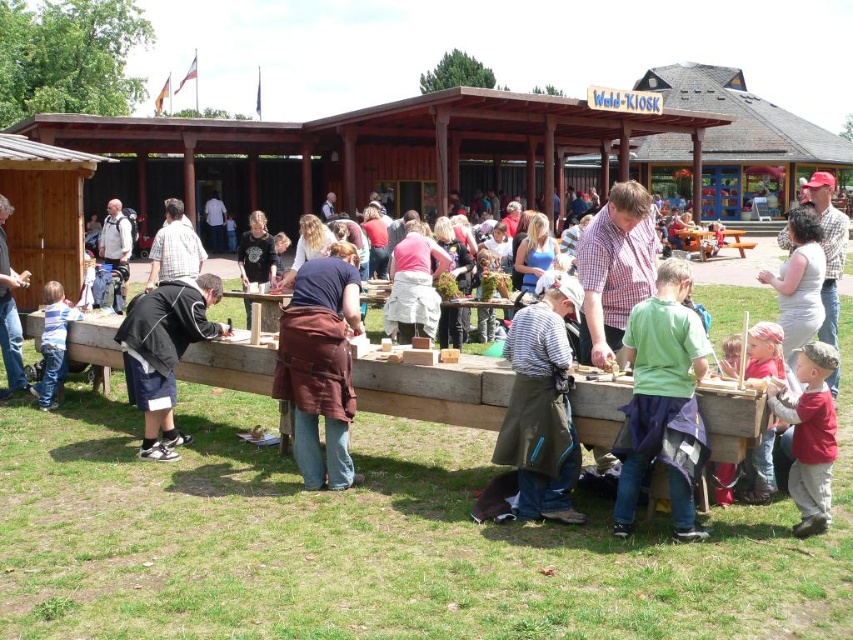
Question: Can you confirm if green fabric apron at lower center is positioned to the left of striped cotton shirt at lower left?

Choices:
 (A) no
 (B) yes

Answer: (A)

Question: Which point appears closest to the camera in this image?

Choices:
 (A) (238, 248)
 (B) (808, 461)
 (C) (677, 241)
 (D) (291, 336)

Answer: (B)

Question: Is red cotton shirt at lower right thinner than dark blue shirt at center?

Choices:
 (A) yes
 (B) no

Answer: (A)

Question: Which point is closer to the camera taking this photo?

Choices:
 (A) (62, 292)
 (B) (334, 412)
 (C) (184, 300)

Answer: (B)

Question: Estimate the real-world distances between objects in this image. Which object is closer to the brown leather apron at center?

Choices:
 (A) striped cotton shirt at lower left
 (B) striped fabric apron at center
 (C) wooden picnic table at center

Answer: (B)

Question: Does wooden table at center appear on the left side of black fabric at lower left?

Choices:
 (A) yes
 (B) no

Answer: (B)